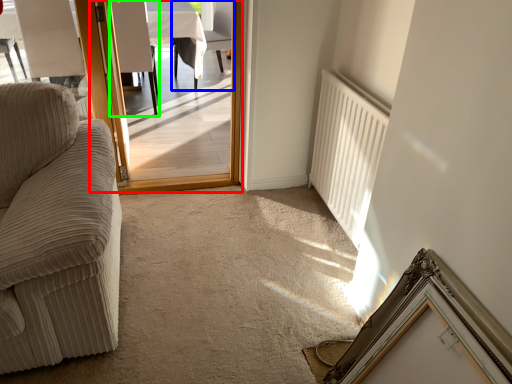
Question: Which is farther away from screen door (highlighted by a red box)? chair (highlighted by a blue box) or armchair (highlighted by a green box)?

Choices:
 (A) chair
 (B) armchair

Answer: (A)